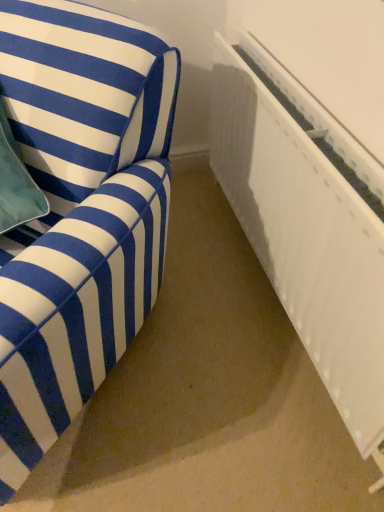
Question: Does white plastic radiator at right appear on the right side of blue striped fabric sofa at left?

Choices:
 (A) yes
 (B) no

Answer: (A)

Question: Considering the relative sizes of white plastic radiator at right and blue striped fabric sofa at left in the image provided, is white plastic radiator at right shorter than blue striped fabric sofa at left?

Choices:
 (A) no
 (B) yes

Answer: (B)

Question: Are white plastic radiator at right and blue striped fabric sofa at left beside each other?

Choices:
 (A) no
 (B) yes

Answer: (A)

Question: Can you confirm if white plastic radiator at right is wider than blue striped fabric sofa at left?

Choices:
 (A) yes
 (B) no

Answer: (B)

Question: Would you say blue striped fabric sofa at left is part of white plastic radiator at right's contents?

Choices:
 (A) no
 (B) yes

Answer: (A)

Question: Would you say white plastic radiator at right is outside blue striped fabric sofa at left?

Choices:
 (A) no
 (B) yes

Answer: (B)

Question: Considering the relative sizes of blue striped fabric sofa at left and white plastic radiator at right in the image provided, is blue striped fabric sofa at left shorter than white plastic radiator at right?

Choices:
 (A) yes
 (B) no

Answer: (B)

Question: From the image's perspective, is blue striped fabric sofa at left under white plastic radiator at right?

Choices:
 (A) no
 (B) yes

Answer: (B)

Question: From a real-world perspective, is blue striped fabric sofa at left over white plastic radiator at right?

Choices:
 (A) yes
 (B) no

Answer: (A)

Question: Would you say blue striped fabric sofa at left contains white plastic radiator at right?

Choices:
 (A) yes
 (B) no

Answer: (B)

Question: Is blue striped fabric sofa at left positioned with its back to white plastic radiator at right?

Choices:
 (A) no
 (B) yes

Answer: (A)

Question: Considering the relative positions of blue striped fabric sofa at left and white plastic radiator at right in the image provided, is blue striped fabric sofa at left to the right of white plastic radiator at right from the viewer's perspective?

Choices:
 (A) no
 (B) yes

Answer: (A)

Question: In terms of width, does white plastic radiator at right look wider or thinner when compared to blue striped fabric sofa at left?

Choices:
 (A) wide
 (B) thin

Answer: (B)